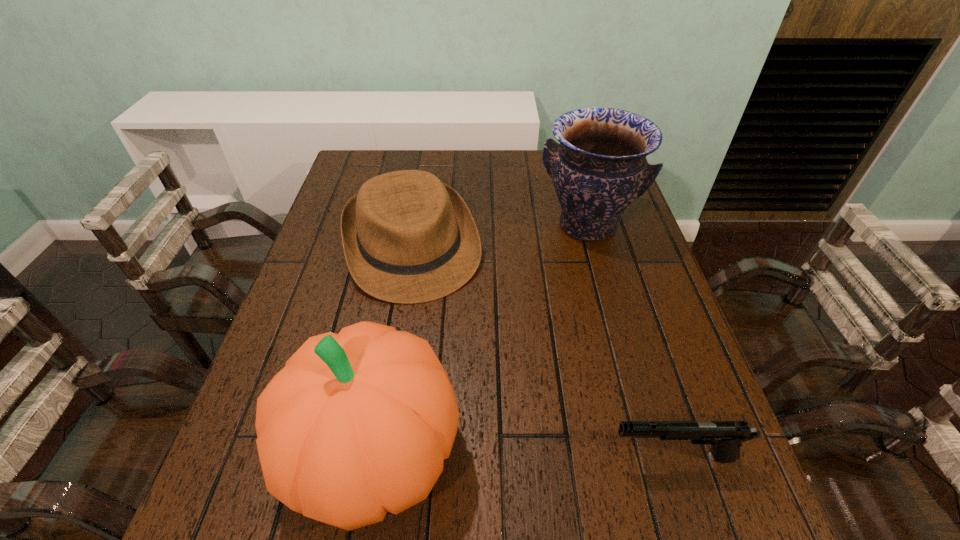
Find the location of `free space located on the front handle of the pottery`. free space located on the front handle of the pottery is located at coordinates (544, 346).

This screenshot has width=960, height=540. I want to click on free space located on the front handle of the pottery, so click(536, 372).

You are a GUI agent. You are given a task and a screenshot of the screen. Output one action in this format:
    pyautogui.click(x=<x>, y=<y>)
    Task: Click on the object located in the near edge section of the desktop
    
    Given the screenshot: What is the action you would take?
    pyautogui.click(x=726, y=437)

Image resolution: width=960 pixels, height=540 pixels. I want to click on object that is positioned at the left edge, so click(x=408, y=238).

The image size is (960, 540). Find the location of `gun at the right edge`. gun at the right edge is located at coordinates (726, 437).

Find the location of a particular element. This screenshot has width=960, height=540. pottery located in the right edge section of the desktop is located at coordinates (599, 168).

The width and height of the screenshot is (960, 540). I want to click on object present at the near right corner, so click(x=726, y=437).

This screenshot has height=540, width=960. I want to click on vacant area at the far edge, so point(483,152).

The height and width of the screenshot is (540, 960). In the image, there is a desktop. Find the location of `vacant space at the near edge`. vacant space at the near edge is located at coordinates click(567, 447).

The height and width of the screenshot is (540, 960). What are the coordinates of `vacant space at the left edge of the desktop` in the screenshot? It's located at (325, 291).